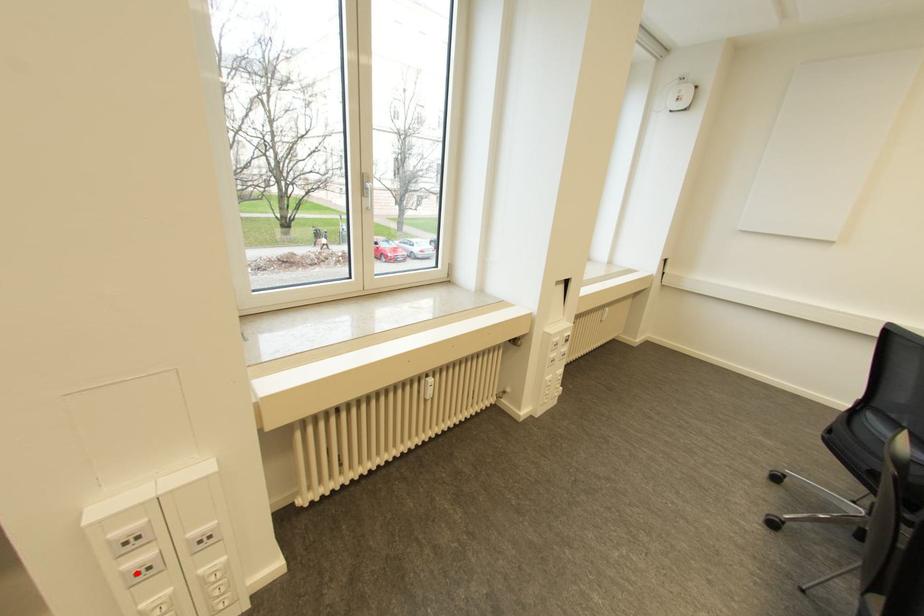
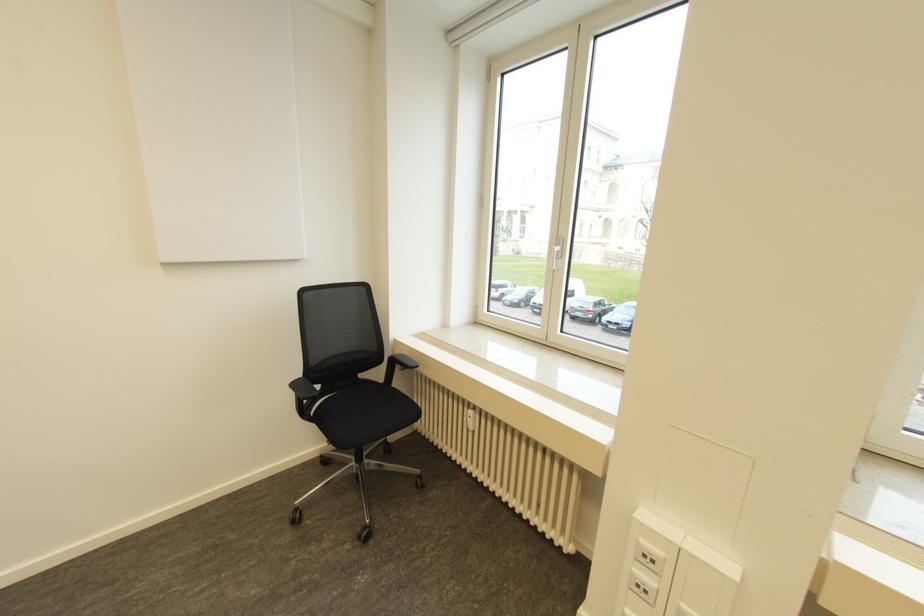
Where in the second image is the point corresponding to the highlighted location from the first image?

(637, 585)